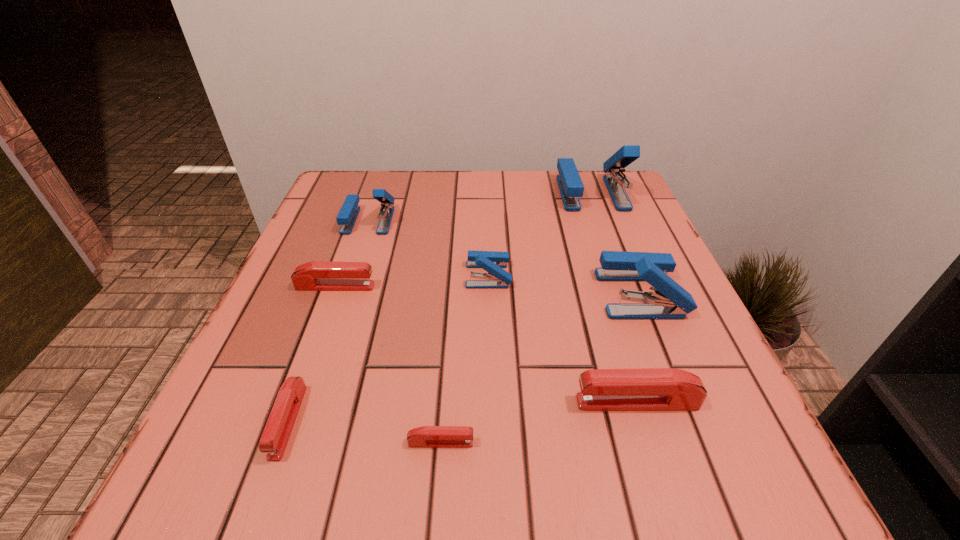
The width and height of the screenshot is (960, 540). Identify the location of empty space between the biggest blue stapler and the third red stapler from left to right. (516, 318).

Where is `free point between the tallest stapler and the third biggest red stapler`? free point between the tallest stapler and the third biggest red stapler is located at coordinates (440, 307).

Where is `free spot between the seventh shortest stapler and the third shortest object`? Image resolution: width=960 pixels, height=540 pixels. free spot between the seventh shortest stapler and the third shortest object is located at coordinates (488, 290).

Where is `object that is the fifth closest one to the seventh shortest stapler`? The height and width of the screenshot is (540, 960). object that is the fifth closest one to the seventh shortest stapler is located at coordinates click(317, 275).

Identify which object is located as the second nearest to the second smallest blue stapler. Please provide its 2D coordinates. Your answer should be formatted as a tuple, i.e. [(x, y)], where the tuple contains the x and y coordinates of a point satisfying the conditions above.

[(492, 262)]

In order to click on stapler that stands as the sixth closest to the smallest red stapler in this screenshot , I will do `click(347, 216)`.

Find the location of a particular element. The height and width of the screenshot is (540, 960). stapler that stands as the seventh closest to the seventh tallest object is located at coordinates pos(571,187).

Choose which blue stapler is the third nearest neighbor to the shortest object. Please provide its 2D coordinates. Your answer should be formatted as a tuple, i.e. [(x, y)], where the tuple contains the x and y coordinates of a point satisfying the conditions above.

[(347, 216)]

The height and width of the screenshot is (540, 960). I want to click on the closest blue stapler relative to the rightmost red stapler, so click(670, 301).

Locate which red stapler is the fourth closest to the third biggest blue stapler. Please provide its 2D coordinates. Your answer should be formatted as a tuple, i.e. [(x, y)], where the tuple contains the x and y coordinates of a point satisfying the conditions above.

[(650, 389)]